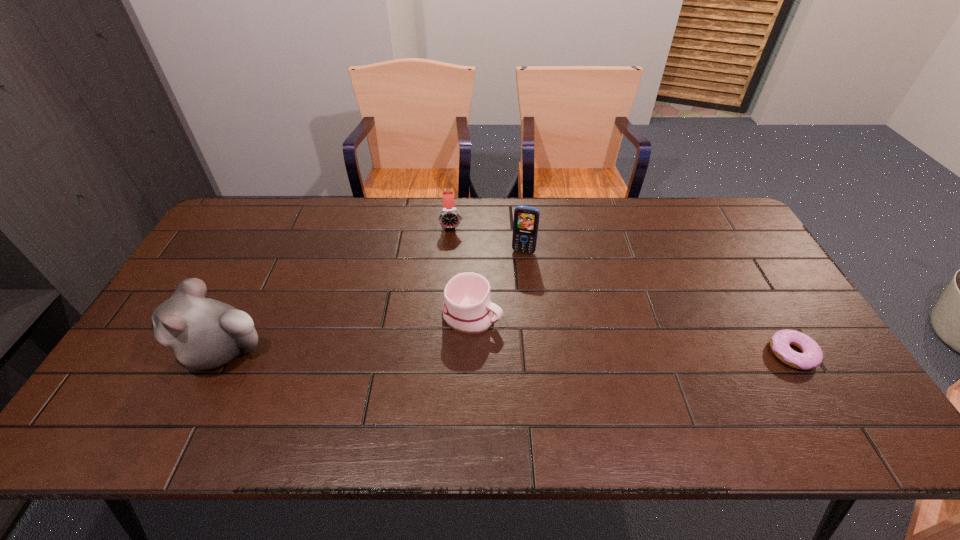
Locate an element on the screen. The width and height of the screenshot is (960, 540). the leftmost object is located at coordinates (203, 333).

Find the location of a particular element. This screenshot has height=540, width=960. doughnut is located at coordinates (811, 357).

Where is `the rightmost object`? This screenshot has width=960, height=540. the rightmost object is located at coordinates (811, 357).

The width and height of the screenshot is (960, 540). Find the location of `the farthest object`. the farthest object is located at coordinates (449, 217).

The height and width of the screenshot is (540, 960). I want to click on mug, so click(x=467, y=308).

Where is `the second farthest object`? This screenshot has width=960, height=540. the second farthest object is located at coordinates (526, 219).

Identify the location of the second object from right to left. (526, 219).

Identify the location of vacant space located 0.070m on the face of the hamster. This screenshot has height=540, width=960. (150, 351).

The width and height of the screenshot is (960, 540). Find the location of `vacant space located on the back of the doughnut`. vacant space located on the back of the doughnut is located at coordinates (768, 312).

At what (x,y) coordinates should I click in order to perform the action: click on free region located on the face of the farthest object. Please return your answer as a coordinate pair (x, y). This screenshot has height=540, width=960. Looking at the image, I should click on (454, 259).